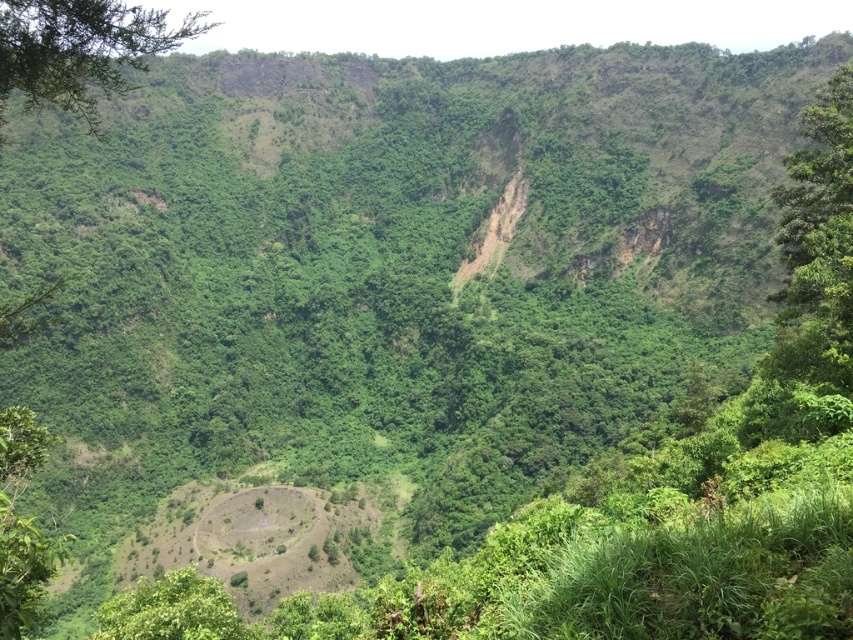
You are hiking through this lush landscape and want to take a photo of both the green leafy tree at right and the green leafy tree at upper left. Which tree should you move closer to in order to capture both in the same frame?

To capture both the green leafy tree at right and the green leafy tree at upper left in the same frame, you should move closer to the green leafy tree at upper left. Since the green leafy tree at right is closer to you, moving towards the farther tree allows you to balance their apparent sizes in the photo.